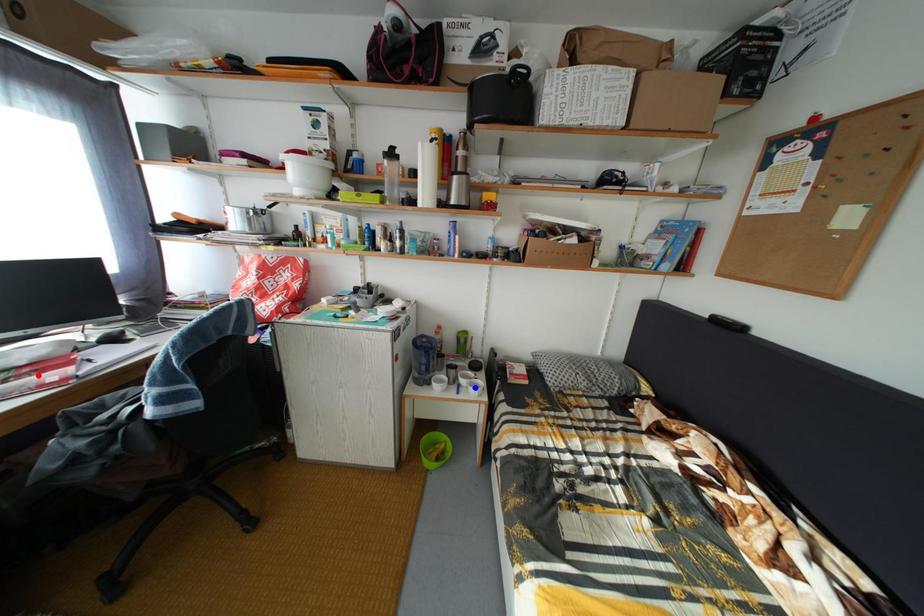
Question: Which of the two points in the image is closer to the camera?

Choices:
 (A) Blue point is closer.
 (B) Red point is closer.

Answer: (B)